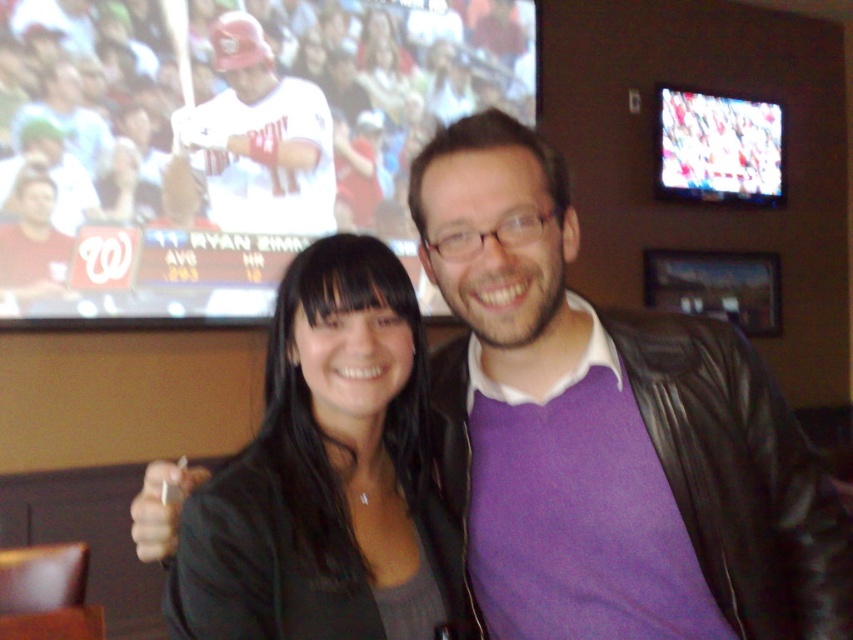
Consider the image. You are designing a poster for a baseball team and need to place the matte white jersey at upper left and the white matte key at center. Based on the scene, which object should be placed first to ensure proper alignment?

The matte white jersey at upper left should be placed first since it might be wider than the white matte key at center, ensuring there is enough space for both elements.

From the picture: You are an assistant helping someone choose an outfit for a casual day out. They want to know which item is shorter in height between the black leather jacket at center and the matte white jersey at upper left. Based on the scene, which one should they choose?

The black leather jacket at center is shorter in height than the matte white jersey at upper left, so they should choose the black leather jacket at center.

You are a fashion designer observing two people in the image. You need to determine which item of clothing is taller between the purple matte sweater at center and the black leather jacket at center. Which one is taller?

The purple matte sweater at center is taller than the black leather jacket at center according to the description.